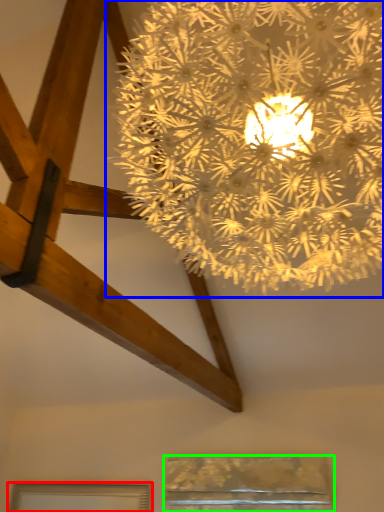
Question: Which object is the closest to the window (highlighted by a red box)? Choose among these: lamp (highlighted by a blue box) or window (highlighted by a green box).

Choices:
 (A) lamp
 (B) window

Answer: (B)